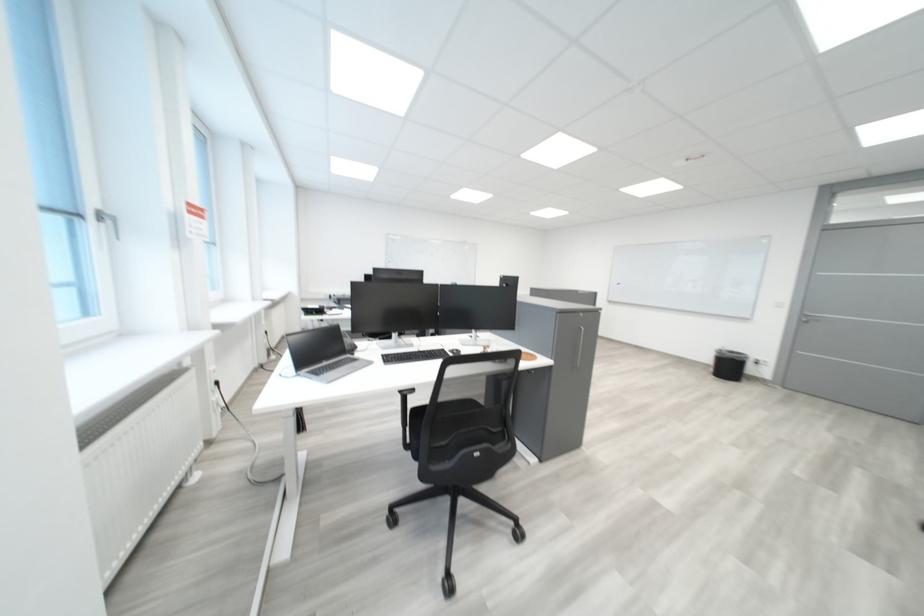
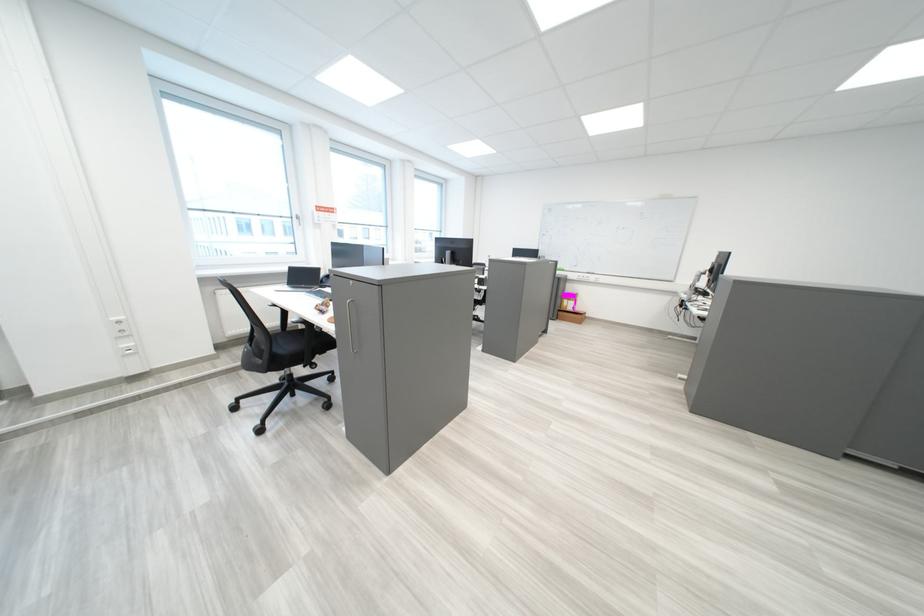
Question: I am providing you with two images of the same scene from different viewpoints. Please identify which objects are invisible in image2.

Choices:
 (A) black chair sitting surface
 (B) chair armrest
 (C) white food processor
 (D) gray cabinet handle

Answer: (B)